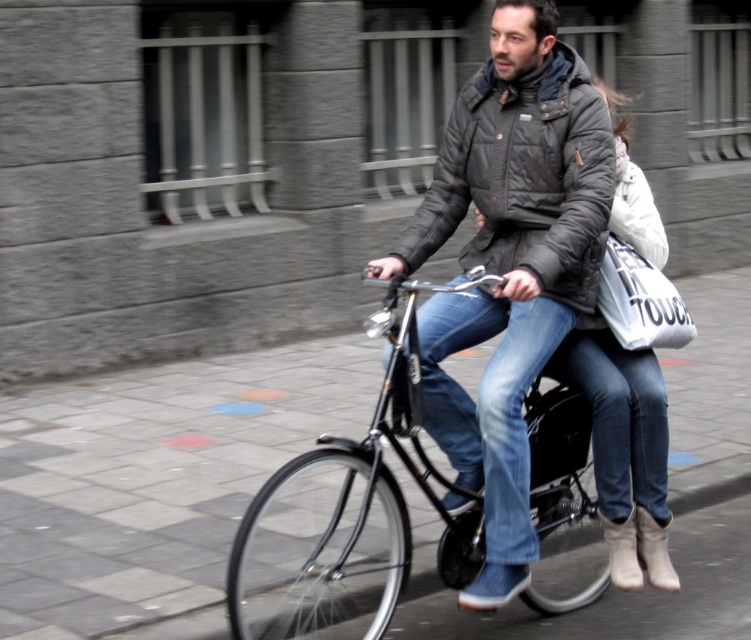
Which is above, black matte bicycle at center or white fabric bag at center?

Positioned higher is white fabric bag at center.

Image resolution: width=751 pixels, height=640 pixels. Describe the element at coordinates (348, 515) in the screenshot. I see `black matte bicycle at center` at that location.

Image resolution: width=751 pixels, height=640 pixels. Identify the location of black matte bicycle at center. (348, 515).

Does black quilted jacket at center have a smaller size compared to white fabric bag at right?

Actually, black quilted jacket at center might be larger than white fabric bag at right.

Does point (505, 257) come farther from viewer compared to point (599, 307)?

No.

Where is `black quilted jacket at center`? This screenshot has width=751, height=640. black quilted jacket at center is located at coordinates (523, 179).

Can you confirm if matte black jacket at center is taller than black quilted jacket at center?

Correct, matte black jacket at center is much taller as black quilted jacket at center.

Between point (427, 355) and point (535, 252), which one is positioned behind?

The point (427, 355) is behind.

This screenshot has width=751, height=640. What do you see at coordinates (508, 262) in the screenshot? I see `matte black jacket at center` at bounding box center [508, 262].

This screenshot has height=640, width=751. I want to click on matte black jacket at center, so click(x=508, y=262).